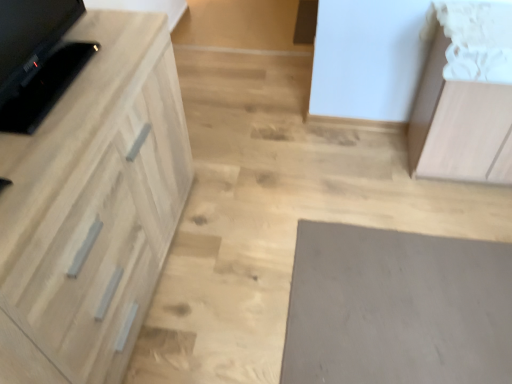
I want to click on vacant area that lies between gray matte mat at lower right and light brown wood cabinet at upper right, the 2th cabinetry viewed from the left, so click(x=406, y=199).